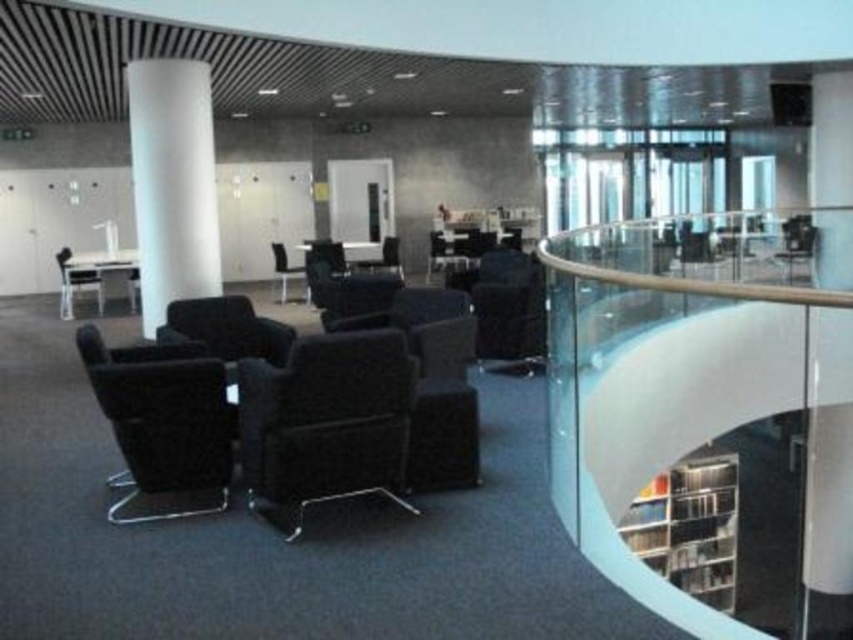
Is point (329, 333) positioned before point (811, 244)?

Yes, it is.

Who is lower down, matte black swivel chair at center or matte black chair at upper right?

Positioned lower is matte black swivel chair at center.

Who is more distant from viewer, (361, 468) or (790, 269)?

The point (790, 269) is more distant.

Locate an element on the screen. matte black swivel chair at center is located at coordinates (326, 420).

Is matte black chair at lower left smaller than matte black armchair at left?

Indeed, matte black chair at lower left has a smaller size compared to matte black armchair at left.

Does point (187, 380) lie behind point (86, 278)?

No.

Locate an element on the screen. This screenshot has height=640, width=853. matte black chair at lower left is located at coordinates (161, 419).

Is matte black swivel chair at center smaller than black leather chair at center?

Correct, matte black swivel chair at center occupies less space than black leather chair at center.

Does point (402, 436) lie in front of point (447, 253)?

Yes.

You are a GUI agent. You are given a task and a screenshot of the screen. Output one action in this format:
    pyautogui.click(x=<x>, y=<y>)
    Task: Click on the matte black swivel chair at center
    The width and height of the screenshot is (853, 640).
    Given the screenshot: What is the action you would take?
    pyautogui.click(x=326, y=420)